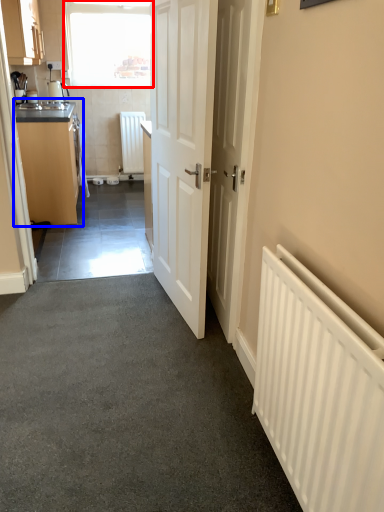
Question: Which object appears closest to the camera in this image, window (highlighted by a red box) or cabinetry (highlighted by a blue box)?

Choices:
 (A) window
 (B) cabinetry

Answer: (B)